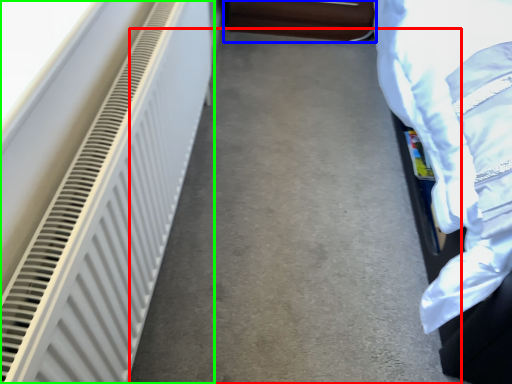
Question: Estimate the real-world distances between objects in this image. Which object is closer to concrete (highlighted by a red box), furniture (highlighted by a blue box) or radiator (highlighted by a green box)?

Choices:
 (A) furniture
 (B) radiator

Answer: (B)